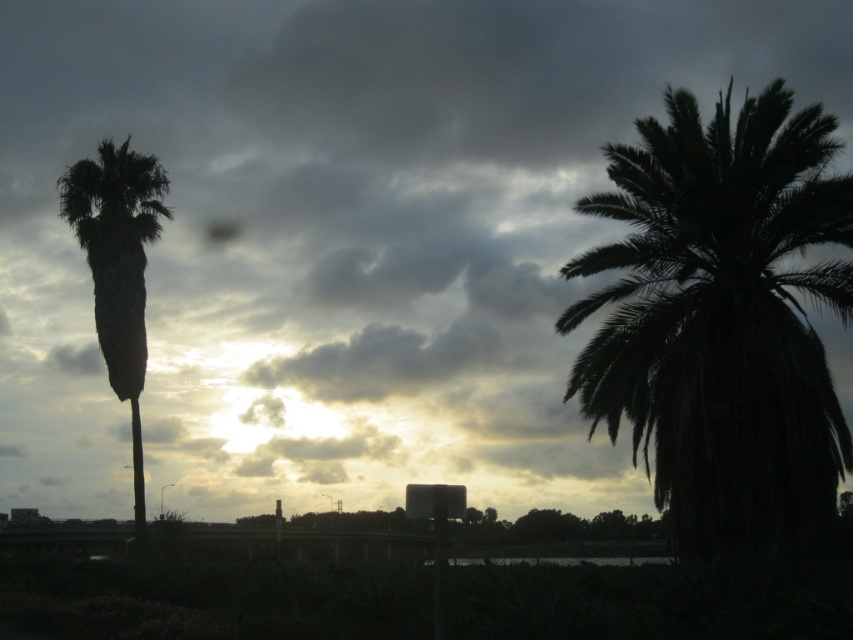
You are a landscape architect planning to place a bench between the dark green leafy palm at right and the green leafy palm at left. The bench requires at least 40 feet of space between the two trees to be placed safely. Can the bench be placed there?

The dark green leafy palm at right is 51.36 feet from the green leafy palm at left. Since the required space is at least 40 feet, the bench can be placed between them.

You are standing in front of the two palm trees in the image. Which palm tree is closer to you, the dark green leafy palm at right or the green leafy palm at left?

The dark green leafy palm at right is positioned over the green leafy palm at left, so the green leafy palm at left is closer to you.

You are standing in front of the palm trees in the image. You notice two points marked in the scene. One is at coordinate point (769, 416) and the other at point (73, 164). Which point is nearer to you?

Point (769, 416) is closer to the viewer than point (73, 164).